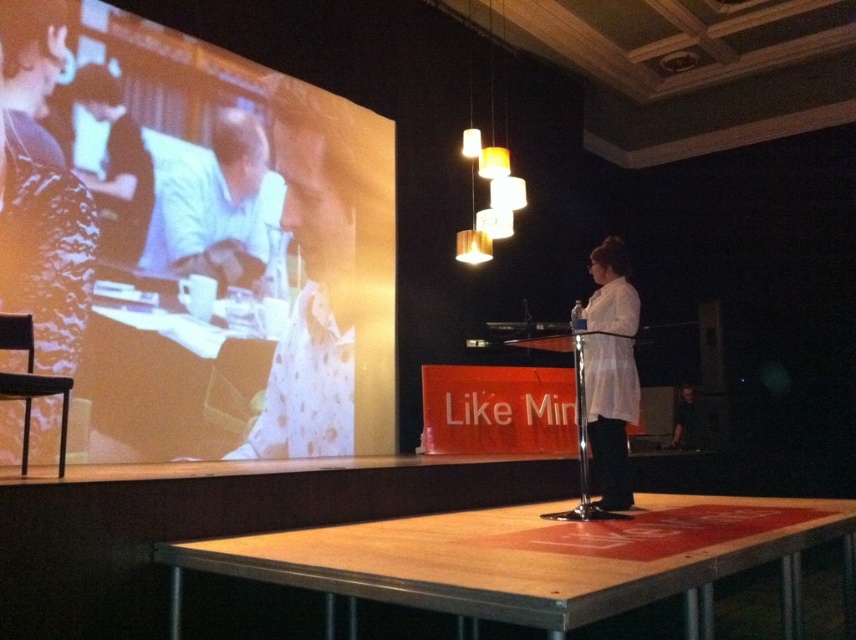
Is white glossy laptop at upper center to the right of white matte shirt at center from the viewer's perspective?

Incorrect, white glossy laptop at upper center is not on the right side of white matte shirt at center.

Between point (223, 195) and point (623, 371), which one is positioned behind?

The point (223, 195) is more distant.

This screenshot has width=856, height=640. In order to click on white glossy laptop at upper center in this screenshot , I will do `click(217, 208)`.